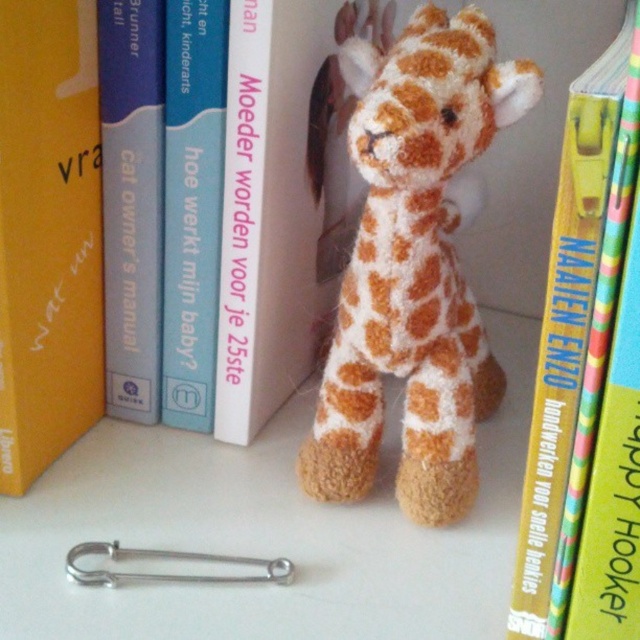
You are organizing a bookshelf and want to place a 2.5 inch wide decorative item between the yellow matte book at upper left and the blue paperback book at left. Will there be enough space?

The distance between the yellow matte book at upper left and the blue paperback book at left is 3.00 inches, so a 2.5 inch wide decorative item can fit in the space between them.

You are organizing a bookshelf and need to place the yellow matte book at upper left and the blue paperback book at upper center. If you want to ensure both books are visible, which book should you place higher up?

The yellow matte book at upper left should be placed higher up since it is larger than the blue paperback book at upper center, allowing both to be visible without blocking each other.

You are a photographer trying to capture the yellow matte book at upper left in focus. Your camera has a depth of field that can sharply focus objects within 25 inches. Can you capture the book in focus without adjusting your camera position?

The yellow matte book at upper left is 28.80 inches from the camera, which is beyond the 25 inches depth of field range. Therefore, you cannot capture it in focus without adjusting the camera position.